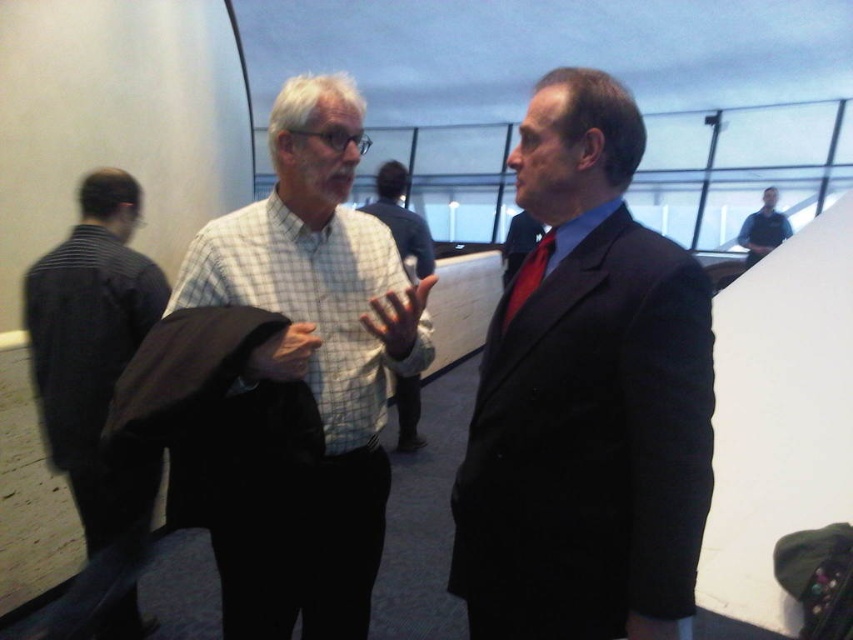
You are an event planner arranging a photo shoot in this indoor space. You need to position two models wearing the white checkered shirt at center and the checkered fabric shirt at center so that they are exactly 7.26 feet apart. Given that the space has a curved architectural element in the background, how should you place them to maintain the required distance while utilizing the space effectively?

Position the two models wearing the white checkered shirt at center and the checkered fabric shirt at center 7.26 feet apart from each other. Place them facing each other near the curved architectural element in the background to utilize the space effectively while maintaining the required distance between them.

In the scene shown: You are standing at point (323,275) and want to walk to point (611,586). Is the path clear of any obstacles between these two points?

The path between point (611,586) and point (323,275) is clear since there are no objects mentioned in the scene description that would block the path.

You are standing in the conference hall and need to locate the white checkered shirt at center. According to the coordinates provided, where would you find it?

The white checkered shirt at center is located at coordinates point (311, 369).